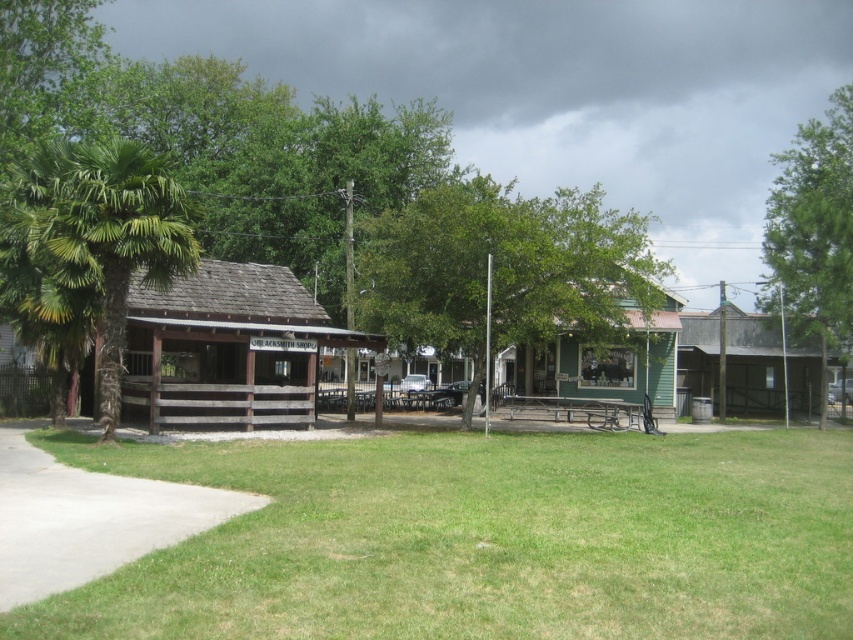
Question: Does green grass at center have a smaller size compared to green wood picnic table at center?

Choices:
 (A) no
 (B) yes

Answer: (B)

Question: Which point is closer to the camera?

Choices:
 (A) green leafy tree at center
 (B) green leafy tree at upper right
 (C) rustic wood hut at center

Answer: (A)

Question: Which of these objects is positioned farthest from the green grass at center?

Choices:
 (A) green wood picnic table at center
 (B) green leafy tree at center
 (C) green leafy palm tree at left

Answer: (B)

Question: Can you confirm if wooden hut at center is smaller than green leafy tree at upper right?

Choices:
 (A) no
 (B) yes

Answer: (B)

Question: Can you confirm if wooden hut at center is positioned below green wood picnic table at center?

Choices:
 (A) no
 (B) yes

Answer: (A)

Question: Which point is farther from the camera taking this photo?

Choices:
 (A) (613, 412)
 (B) (782, 195)

Answer: (B)